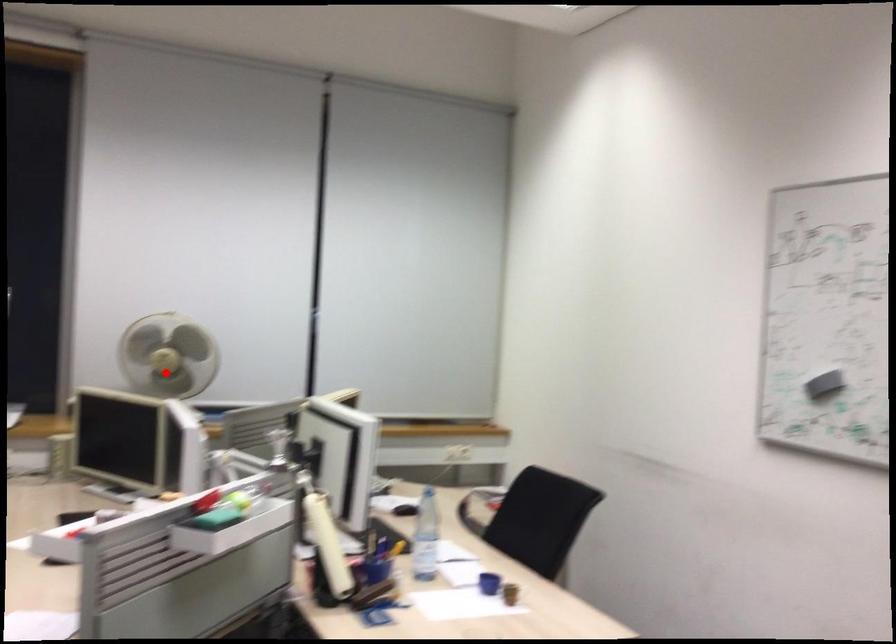
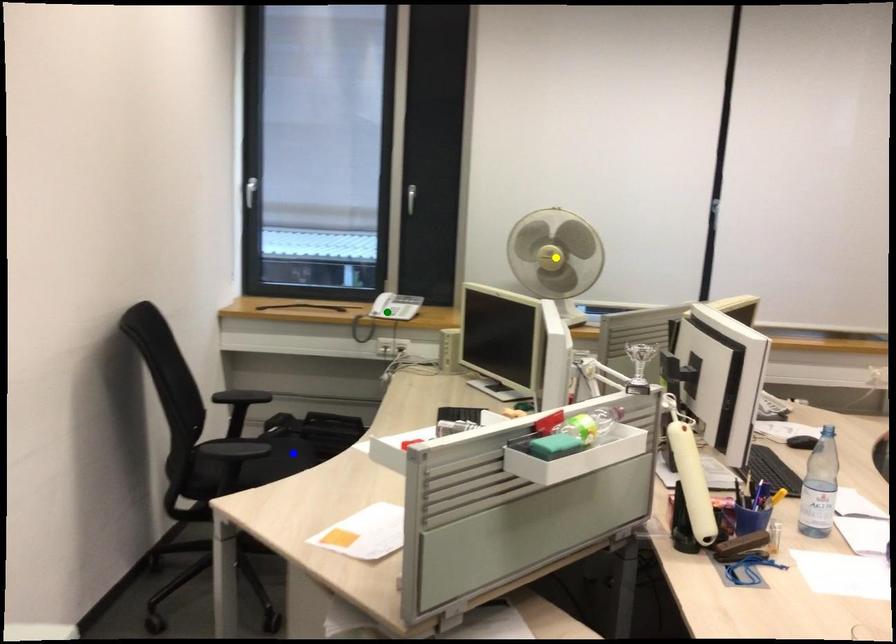
Question: I am providing you with two images of the same scene from different viewpoints. A red point is marked on the first image. You are given multiple points on the second image. Which mark in image 2 goes with the point in image 1?

Choices:
 (A) blue point
 (B) yellow point
 (C) green point

Answer: (B)